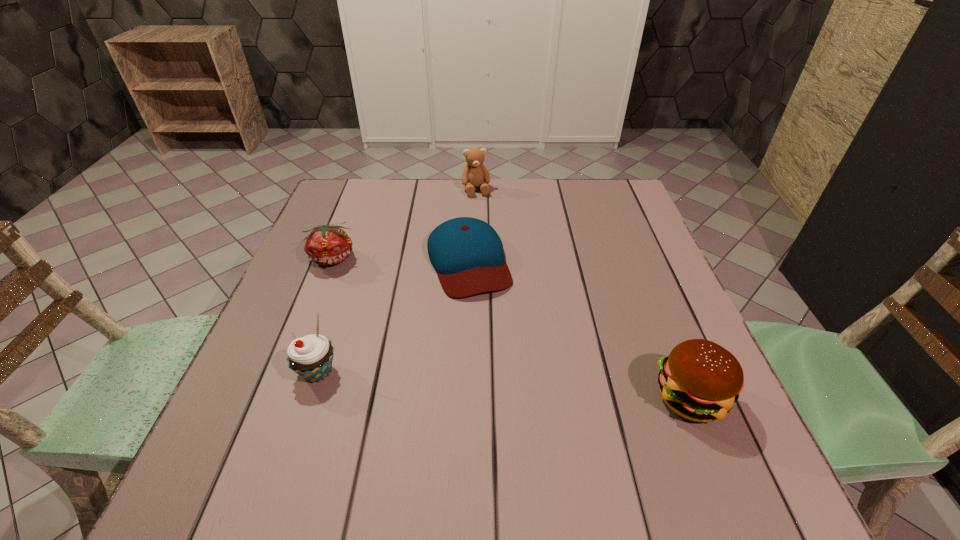
Locate an element on the screen. This screenshot has width=960, height=540. cupcake is located at coordinates [x=311, y=356].

The width and height of the screenshot is (960, 540). What are the coordinates of `hamburger` in the screenshot? It's located at (700, 380).

Find the location of a particular element. This screenshot has height=540, width=960. teddy bear is located at coordinates (475, 174).

Locate an element on the screen. This screenshot has height=540, width=960. tomato is located at coordinates (326, 245).

Find the location of a particular element. baseball cap is located at coordinates (467, 253).

Locate an element on the screen. vacant area situated on the back of the cupcake is located at coordinates (352, 267).

I want to click on vacant space located 0.400m on the left of the rightmost object, so click(x=438, y=396).

Identify the location of vacant region located 0.370m on the face of the teddy bear. This screenshot has height=540, width=960. (498, 280).

Locate an element on the screen. The image size is (960, 540). free space located on the face of the teddy bear is located at coordinates [483, 216].

The image size is (960, 540). Identify the location of free location located 0.180m on the face of the teddy bear. (487, 233).